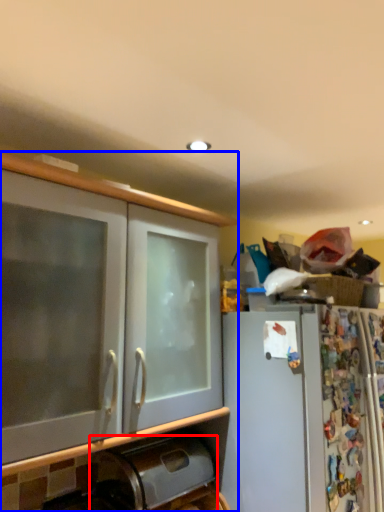
Question: Which object appears closest to the camera in this image, appliance (highlighted by a red box) or cabinetry (highlighted by a blue box)?

Choices:
 (A) appliance
 (B) cabinetry

Answer: (B)